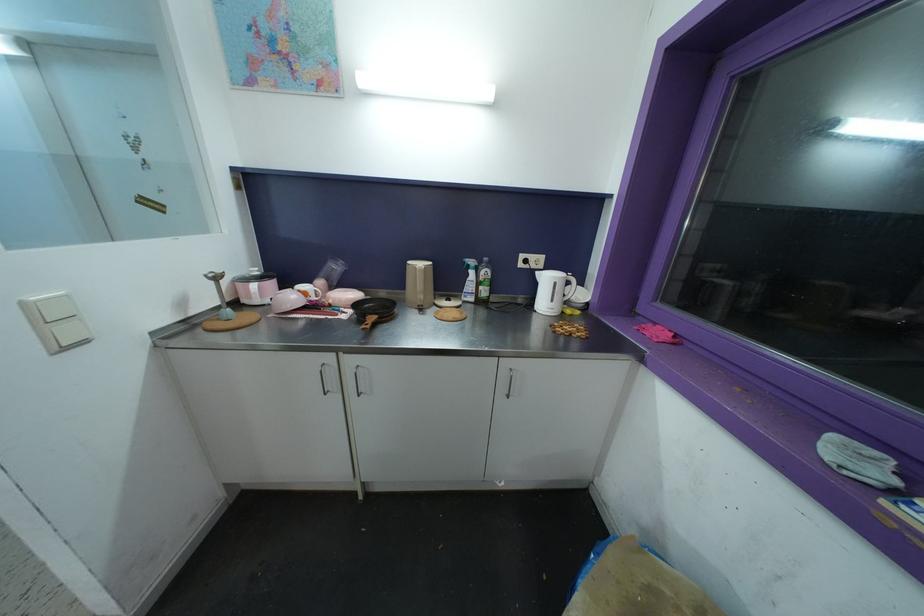
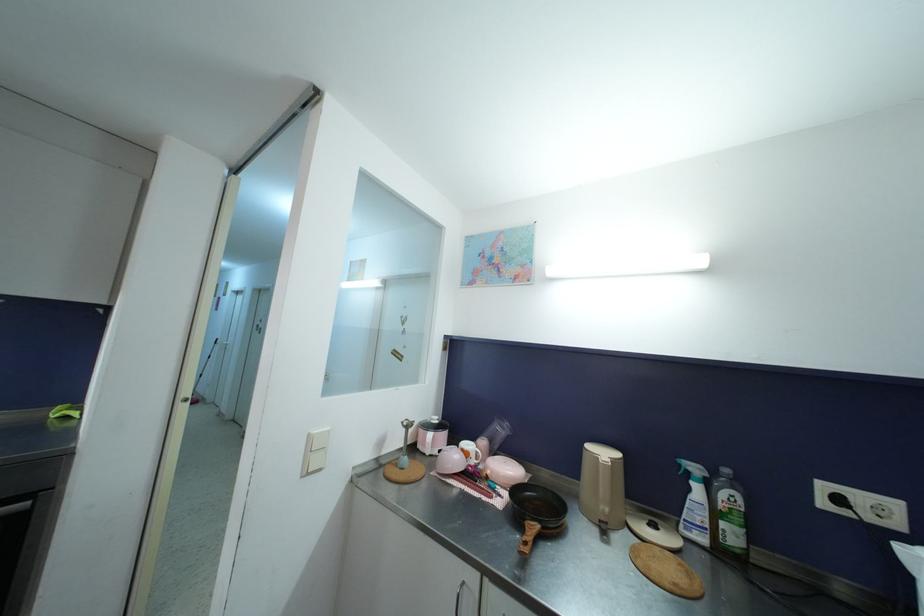
Based on the continuous images, in which direction is the camera rotating?

The rotation direction of the camera is left-up.